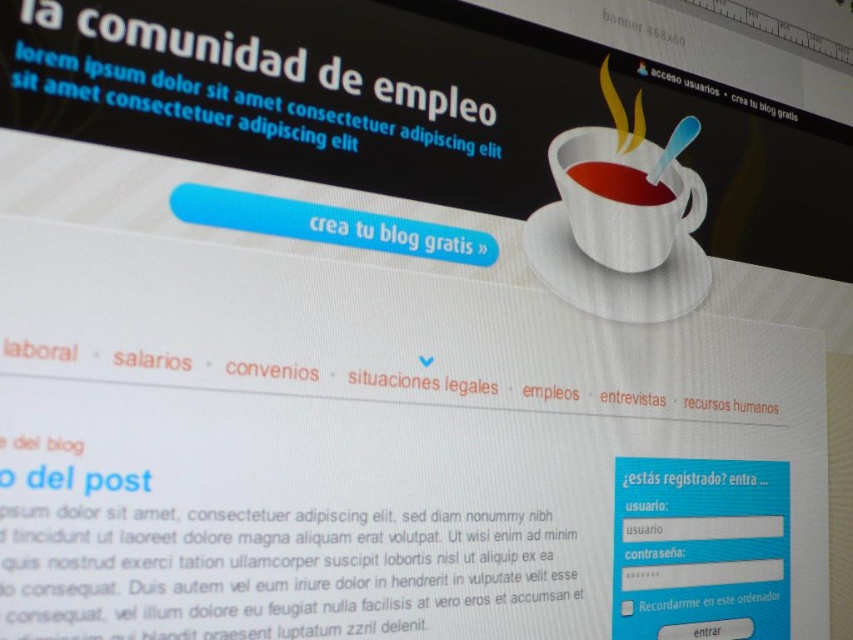
You are designing a layout for a webpage and see the matte white cup at upper right and the matte ceramic cup at upper right. Which cup appears closer to you?

The matte white cup at upper right is in front of the matte ceramic cup at upper right, so it appears closer.

You are a graphic designer working on a webpage layout. You need to ensure that the two cups on the screen are spaced at least 1 inch apart for readability. Are the matte white cup at upper right and the matte ceramic cup at upper right meeting this requirement?

The distance between the matte white cup at upper right and the matte ceramic cup at upper right is 1.02 inches, which meets the minimum spacing requirement of 1 inch for readability.

You are trying to place a saucer under the matte white cup at upper right and the matte ceramic cup at upper right. Which cup requires a larger saucer?

The matte white cup at upper right requires a larger saucer because it might be wider than the matte ceramic cup at upper right.